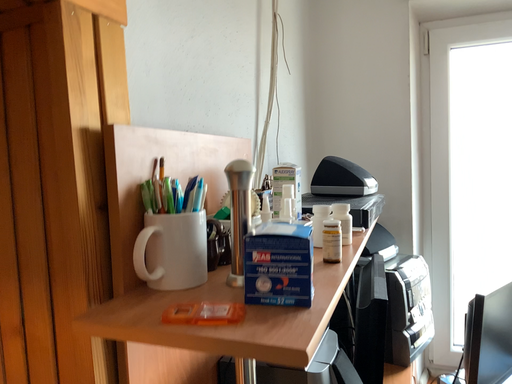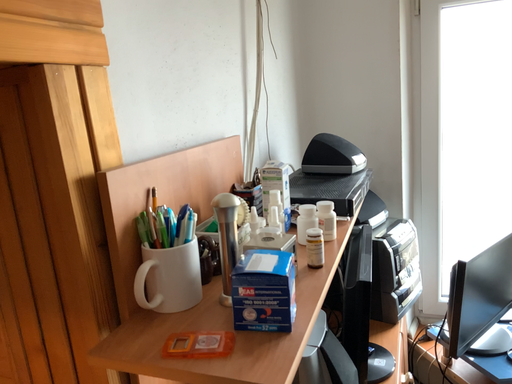
Question: How did the camera likely rotate when shooting the video?

Choices:
 (A) rotated upward
 (B) rotated downward

Answer: (B)